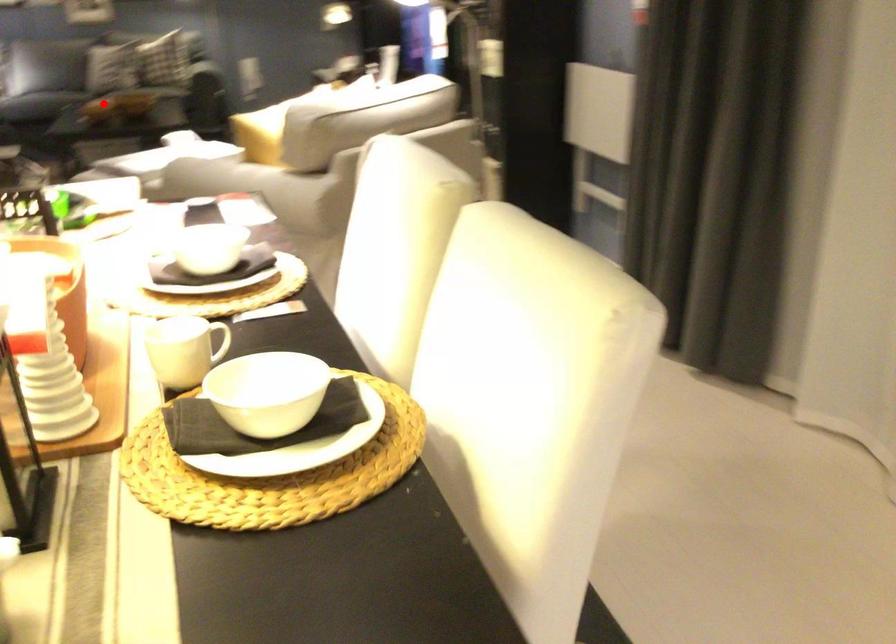
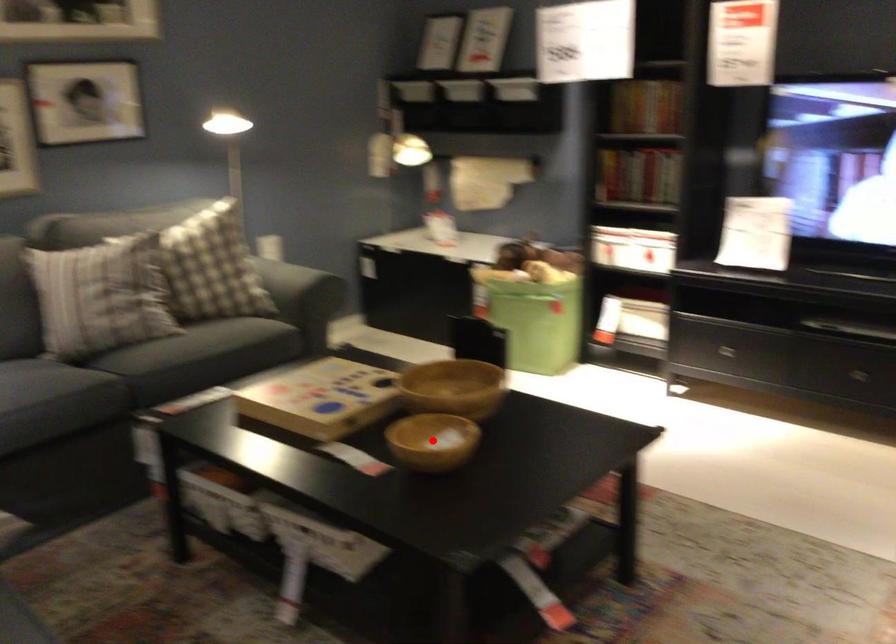
I am providing you with two images of the same scene from different viewpoints. A red point is marked on the first image and another point is marked on the second image. Is the red point in image1 aligned with the point shown in image2?

Yes